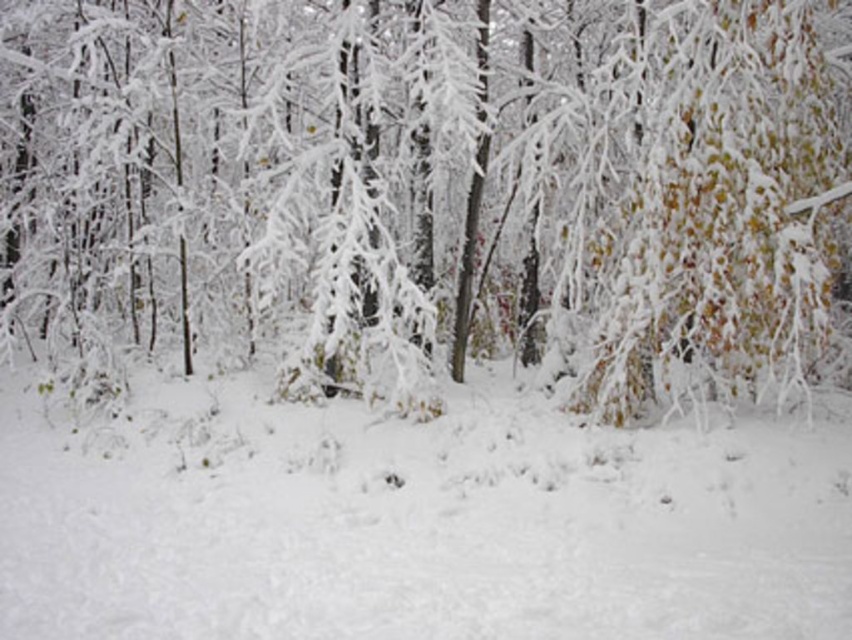
Is white frosty tree at center positioned behind white fluffy snow at center?

Yes.

Does white frosty tree at center have a lesser width compared to white fluffy snow at center?

Incorrect, white frosty tree at center's width is not less than white fluffy snow at center's.

This screenshot has height=640, width=852. Identify the location of white frosty tree at center. (426, 192).